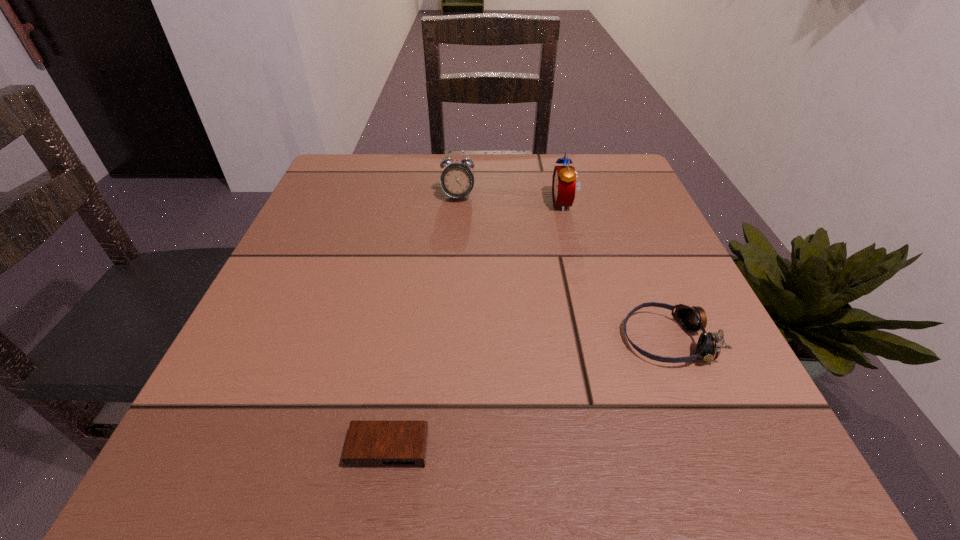
Image resolution: width=960 pixels, height=540 pixels. What are the coordinates of `the second object from right to left` in the screenshot? It's located at (564, 184).

Where is `the tallest alarm clock`? Image resolution: width=960 pixels, height=540 pixels. the tallest alarm clock is located at coordinates (564, 184).

Identify the location of the second tallest object. The image size is (960, 540). (457, 180).

This screenshot has height=540, width=960. I want to click on the second shortest object, so click(692, 319).

Where is `the rightmost object`? The height and width of the screenshot is (540, 960). the rightmost object is located at coordinates (692, 319).

This screenshot has width=960, height=540. What are the coordinates of `the nearest alarm clock` in the screenshot? It's located at tap(369, 444).

Where is `the shortest alarm clock`? The height and width of the screenshot is (540, 960). the shortest alarm clock is located at coordinates (369, 444).

The height and width of the screenshot is (540, 960). In order to click on vacant space positioned 0.050m on the front-facing side of the tallest object in this screenshot , I will do point(530,204).

The width and height of the screenshot is (960, 540). I want to click on free region located on the front-facing side of the tallest object, so click(x=420, y=204).

In order to click on vacant space located 0.060m on the front-facing side of the tallest object in this screenshot , I will do (525, 204).